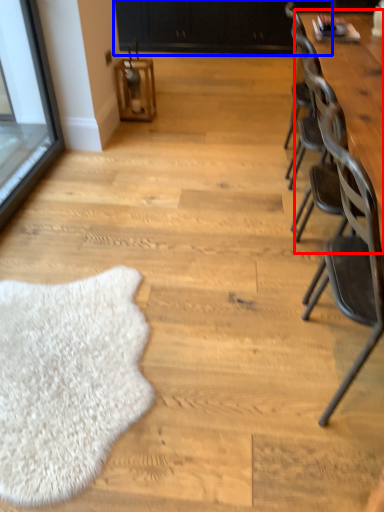
Question: Among these objects, which one is nearest to the camera, table (highlighted by a red box) or dresser (highlighted by a blue box)?

Choices:
 (A) table
 (B) dresser

Answer: (A)